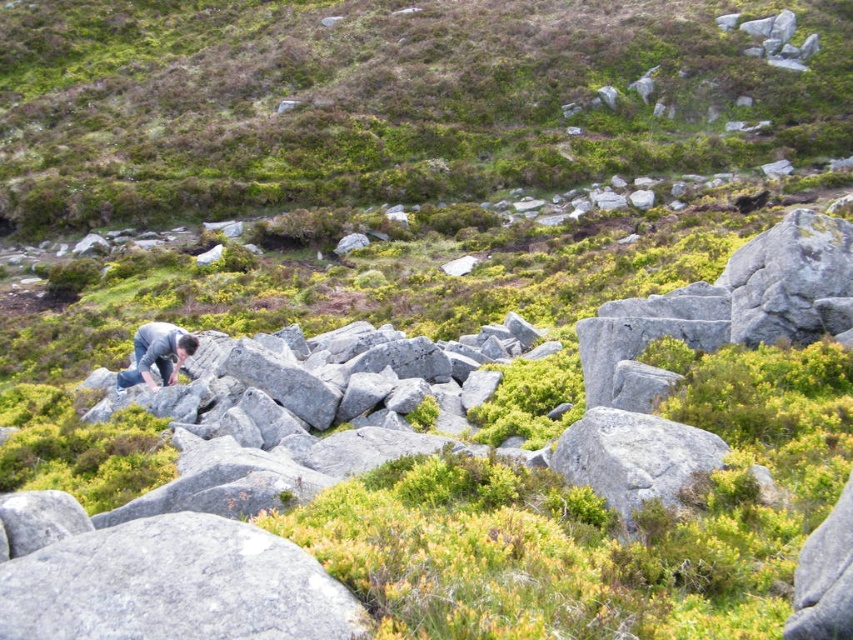
You are a hiker who wants to cross a rocky area. You see a gray rough boulder at lower left and a dark gray fabric at lower left. Which one is shorter?

The gray rough boulder at lower left is shorter than the dark gray fabric at lower left according to the description.

You are standing in the rugged outdoor scene with large gray rocks and green vegetation. You notice two points marked in the image. The first point is at coordinate point (672,472) and the second is at coordinate point (181,330). Which of these two points is closer to your current position?

Point (672,472) is closer to the viewer than point (181,330).